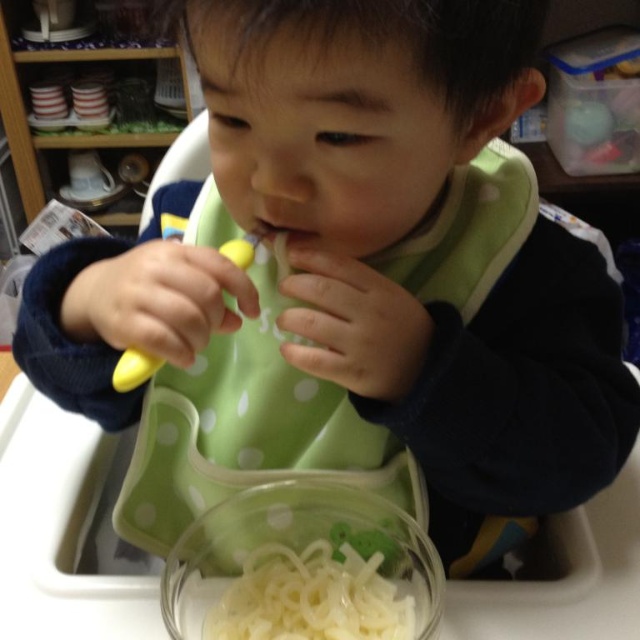
You are a parent trying to determine if the pink matte flesh at center can fit into the translucent plastic bowl at lower center. Based on their heights, can it fit inside?

The translucent plastic bowl at lower center is taller than the pink matte flesh at center, so the pink matte flesh at center can fit inside the bowl.

You are a parent trying to ensure your child eats their meal. The child is holding a yellow spoon and the translucent plastic bowl at lower center contains the white glossy noodles at lower center. Since the bowl is in front of the noodles, can the child easily reach the noodles with the spoon?

The translucent plastic bowl at lower center is in front of the white glossy noodles at lower center, meaning the noodles are behind the bowl. This positioning might make it difficult for the child to reach the noodles with the spoon as the bowl is blocking access to them.

You are a photographer taking a picture of the child in the high chair. You notice two points in the scene marked as point 1 at coordinates (262, 547) and point 2 at coordinates (252, 225). Which point should you focus on to ensure the child is in sharp focus?

Point 2 at coordinates (252, 225) should be focused on because it is closer to the camera than point 1 at coordinates (262, 547), ensuring the child in the high chair is in sharp focus.